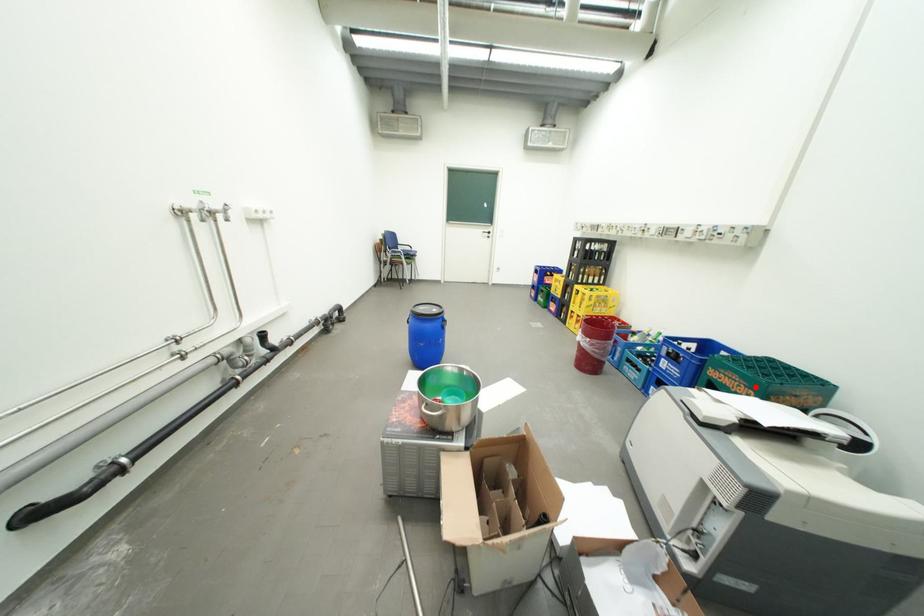
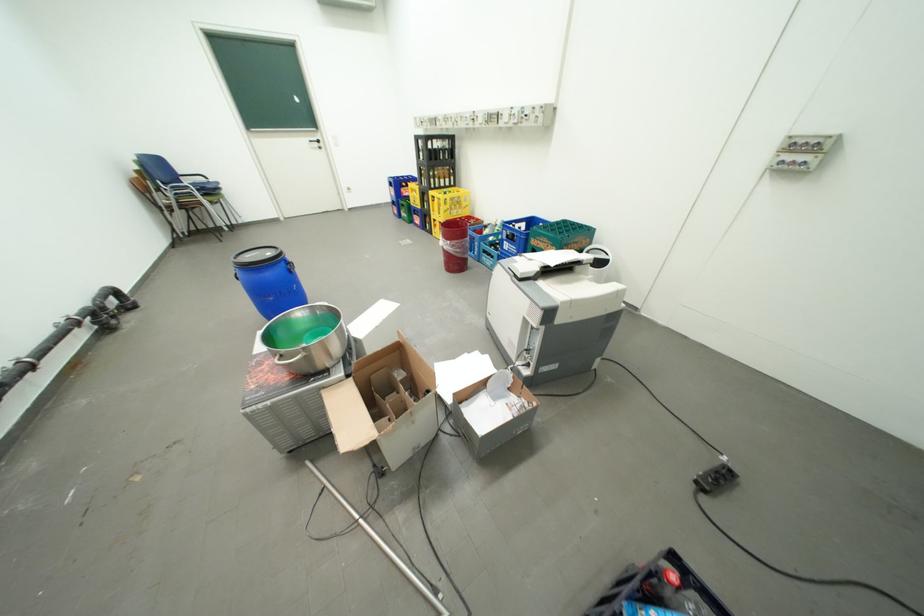
Find the pixel in the second image that matches the highlighted location in the first image.

(562, 246)